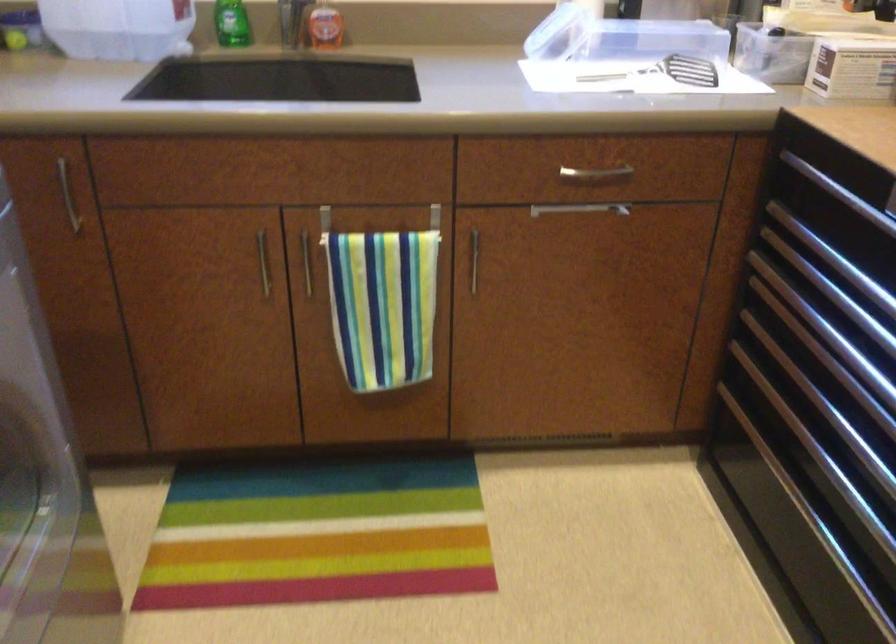
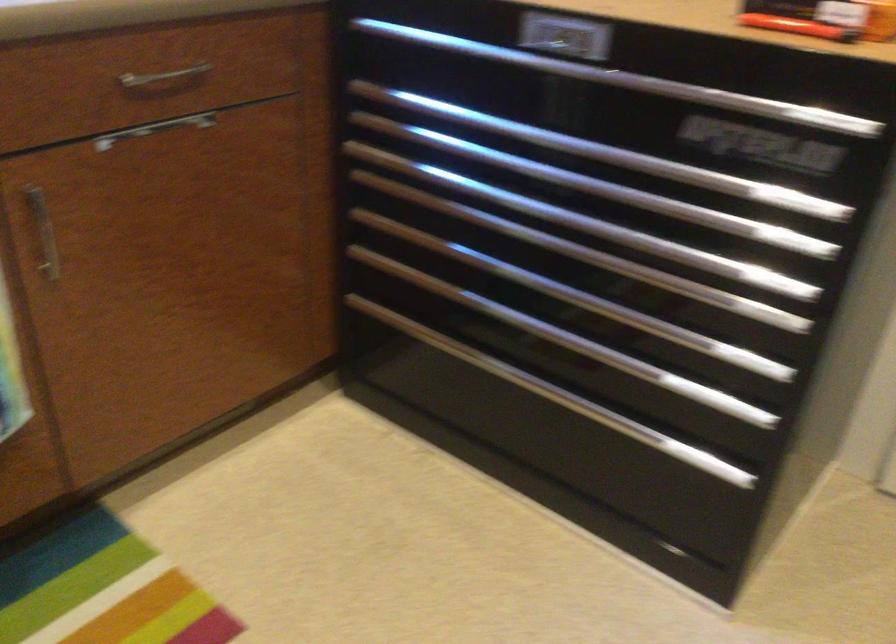
Locate, in the second image, the point that corresponds to pixel 597 169 in the first image.

(164, 78)